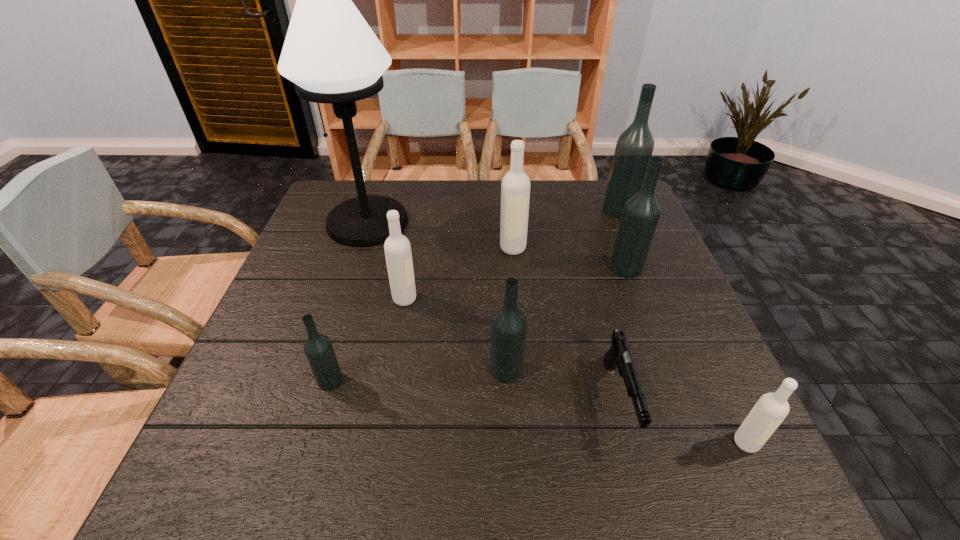
Identify the location of table lamp. This screenshot has height=540, width=960. (330, 53).

This screenshot has width=960, height=540. I want to click on black table lamp, so click(330, 53).

You are a GUI agent. You are given a task and a screenshot of the screen. Output one action in this format:
    pyautogui.click(x=<x>, y=<y>)
    Task: Click on the eighth shortest object
    The height and width of the screenshot is (540, 960).
    Given the screenshot: What is the action you would take?
    pyautogui.click(x=634, y=147)

At what (x,y) coordinates should I click in order to perform the action: click on the tallest vodka. Please return your answer as a coordinate pair (x, y). The width and height of the screenshot is (960, 540). Looking at the image, I should click on (634, 147).

The height and width of the screenshot is (540, 960). Identify the location of the biggest white vodka. (515, 187).

The width and height of the screenshot is (960, 540). I want to click on the farthest white vodka, so click(515, 187).

I want to click on the second biggest black vodka, so click(x=641, y=213).

At what (x,y) coordinates should I click in order to perform the action: click on the third nearest black vodka. Please return your answer as a coordinate pair (x, y). Looking at the image, I should click on (641, 213).

At what (x,y) coordinates should I click in order to perform the action: click on the leftmost white vodka. Please return your answer as a coordinate pair (x, y). This screenshot has height=540, width=960. Looking at the image, I should click on (397, 248).

Identify the location of the second nearest white vodka. (397, 248).